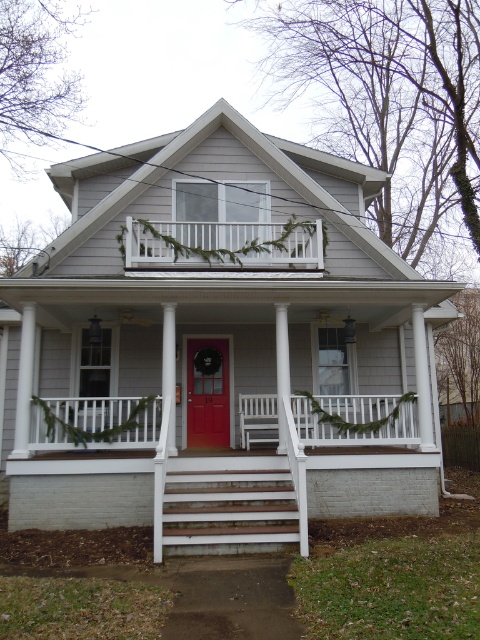
Question: Does wooden stairs at center have a greater width compared to matte red door at center?

Choices:
 (A) yes
 (B) no

Answer: (A)

Question: Which object appears closest to the camera in this image?

Choices:
 (A) white painted wood porch at upper center
 (B) wooden stairs at center
 (C) matte red door at center

Answer: (B)

Question: Which point appears farthest from the camera in this image?

Choices:
 (A) (193, 365)
 (B) (280, 230)
 (C) (164, 499)

Answer: (A)

Question: Which of the following is the farthest from the observer?

Choices:
 (A) (249, 524)
 (B) (188, 392)

Answer: (B)

Question: Where is wooden stairs at center located in relation to matte red door at center in the image?

Choices:
 (A) below
 (B) above

Answer: (A)

Question: Is wooden stairs at center bigger than matte red door at center?

Choices:
 (A) no
 (B) yes

Answer: (B)